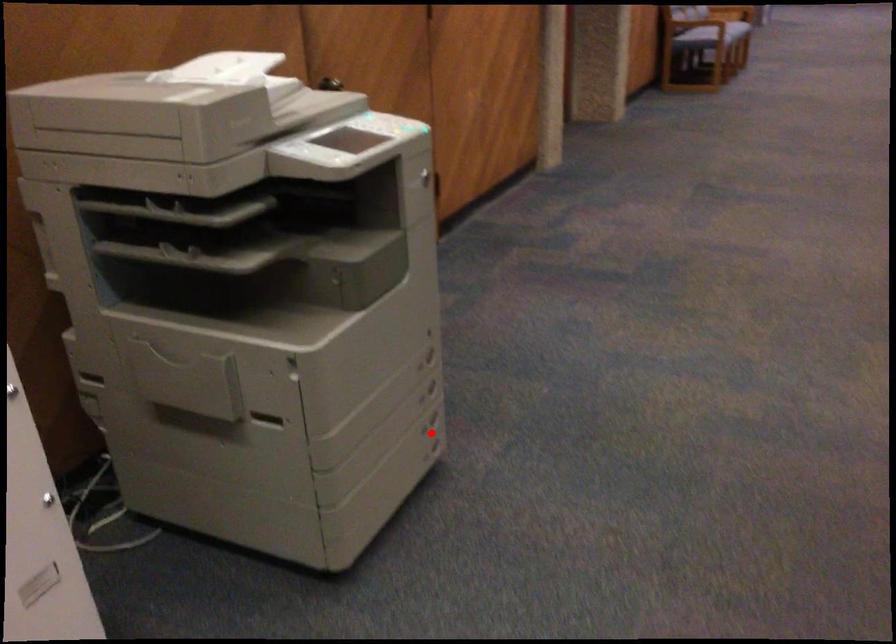
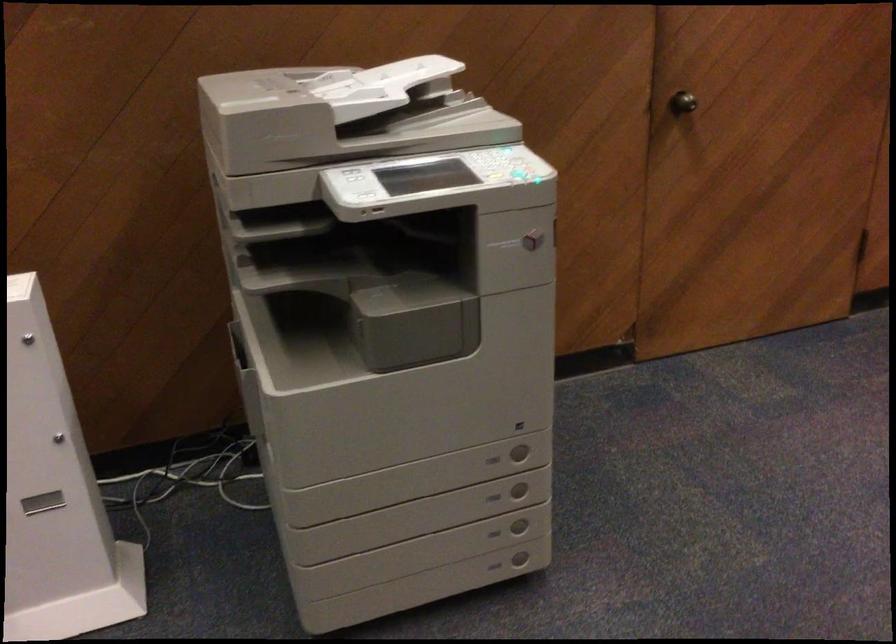
Question: A red point is marked in image1. In image2, is the corresponding 3D point closer to the camera or farther? Reply with the corresponding letter.

Choices:
 (A) The corresponding 3D point is closer.
 (B) The corresponding 3D point is farther.

Answer: (A)